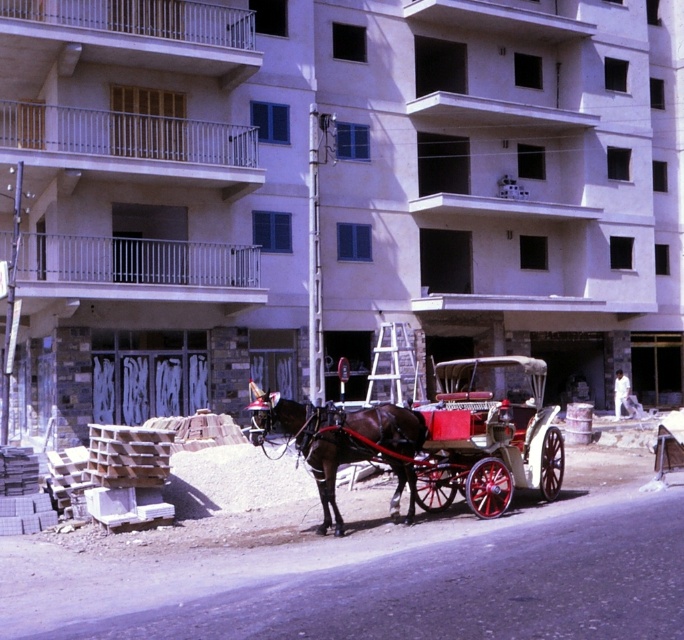
Does polished wood horse cart at center have a lesser height compared to shiny brown horse at center?

Incorrect, polished wood horse cart at center's height does not fall short of shiny brown horse at center's.

Who is more distant from viewer, (x=432, y=493) or (x=300, y=416)?

Positioned behind is point (x=432, y=493).

Who is more forward, (471, 486) or (415, 444)?

Positioned in front is point (471, 486).

Where is `polished wood horse cart at center`? This screenshot has height=640, width=684. polished wood horse cart at center is located at coordinates (486, 440).